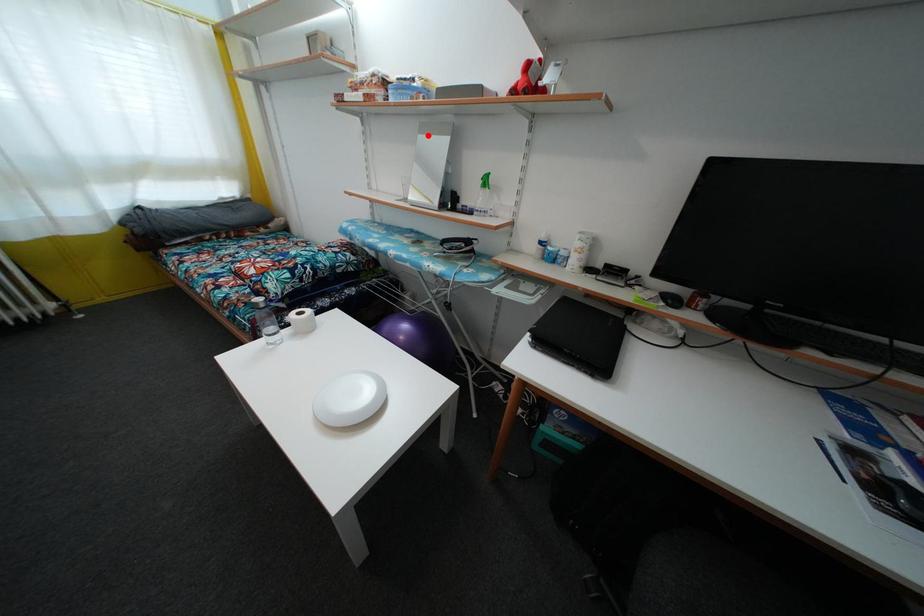
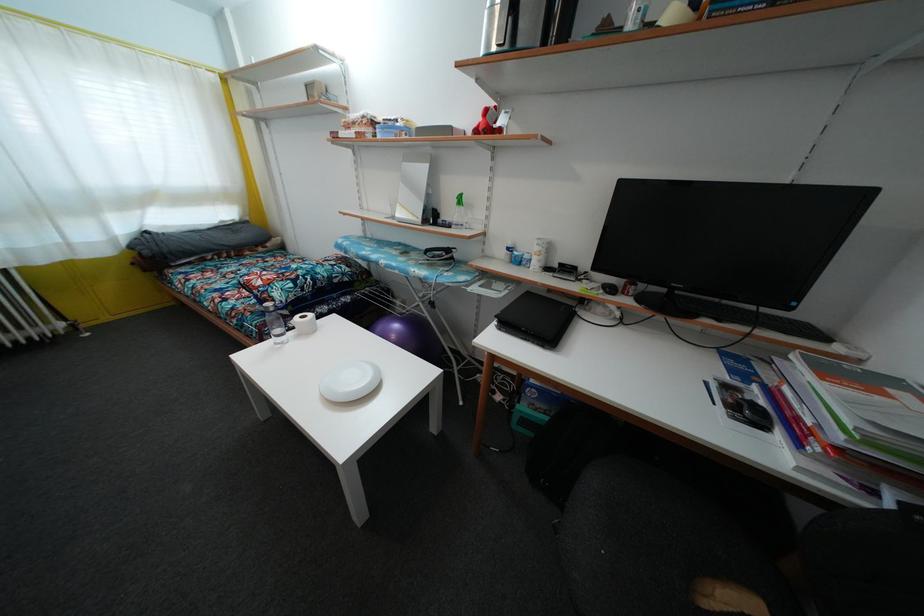
Find the pixel in the second image that matches the highlighted location in the first image.

(410, 164)